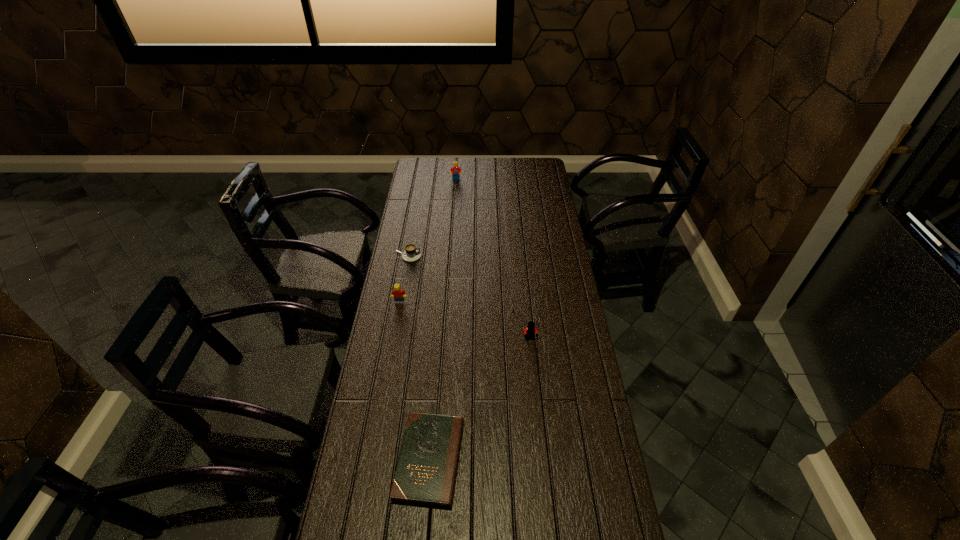
Locate an element on the screen. Image resolution: width=960 pixels, height=540 pixels. free space that satisfies the following two spatial constraints: 1. on the face of the farthest Lego; 2. with the handle on the side of the second shortest object is located at coordinates (450, 256).

Where is `free space in the image that satisfies the following two spatial constraints: 1. on the face of the second Lego from right to left; 2. with the handle on the side of the cappuccino`? This screenshot has height=540, width=960. free space in the image that satisfies the following two spatial constraints: 1. on the face of the second Lego from right to left; 2. with the handle on the side of the cappuccino is located at coordinates (450, 256).